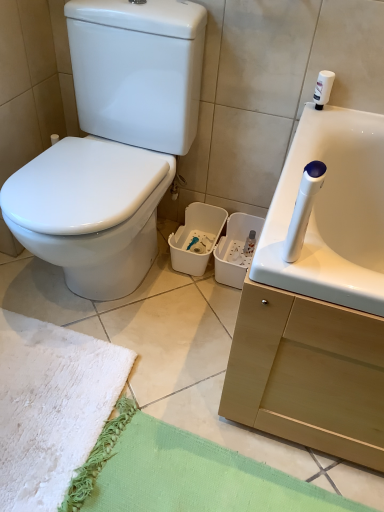
Question: From a real-world perspective, is white glossy toilet at left positioned over white fluffy beach towel at lower left based on gravity?

Choices:
 (A) yes
 (B) no

Answer: (A)

Question: Is white glossy toilet at left thinner than white fluffy beach towel at lower left?

Choices:
 (A) no
 (B) yes

Answer: (A)

Question: Can you confirm if white glossy toilet at left is wider than white fluffy beach towel at lower left?

Choices:
 (A) yes
 (B) no

Answer: (A)

Question: Considering the relative positions of white glossy toilet at left and white fluffy beach towel at lower left in the image provided, is white glossy toilet at left behind white fluffy beach towel at lower left?

Choices:
 (A) no
 (B) yes

Answer: (A)

Question: From the image's perspective, is white glossy toilet at left under white fluffy beach towel at lower left?

Choices:
 (A) yes
 (B) no

Answer: (B)

Question: Is white glossy toilet at left positioned with its back to white fluffy beach towel at lower left?

Choices:
 (A) no
 (B) yes

Answer: (A)

Question: Is white fluffy beach towel at lower left at the right side of white glossy toilet at left?

Choices:
 (A) yes
 (B) no

Answer: (B)

Question: Is white fluffy beach towel at lower left positioned beyond the bounds of white glossy toilet at left?

Choices:
 (A) yes
 (B) no

Answer: (A)

Question: Is white fluffy beach towel at lower left in front of white glossy toilet at left?

Choices:
 (A) no
 (B) yes

Answer: (A)

Question: Does white fluffy beach towel at lower left contain white glossy toilet at left?

Choices:
 (A) no
 (B) yes

Answer: (A)

Question: Is white fluffy beach towel at lower left behind white glossy toilet at left?

Choices:
 (A) no
 (B) yes

Answer: (B)

Question: Is white fluffy beach towel at lower left not near white glossy toilet at left?

Choices:
 (A) no
 (B) yes

Answer: (A)

Question: In the image, is white fluffy beach towel at lower left on the left side or the right side of white glossy toilet at left?

Choices:
 (A) left
 (B) right

Answer: (A)